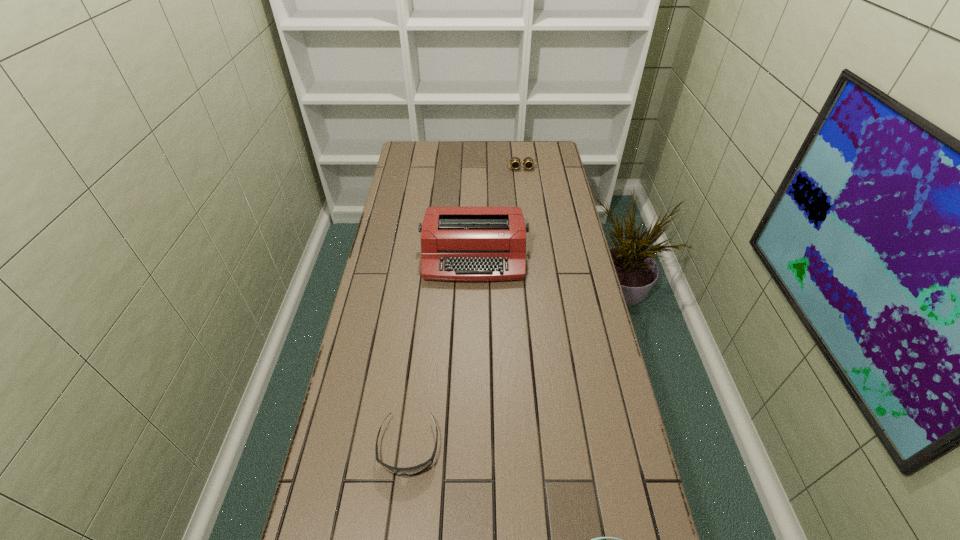
Image resolution: width=960 pixels, height=540 pixels. In order to click on object that stands as the third closest to the typewriter in this screenshot , I will do `click(595, 539)`.

Where is `the closest object to the nearest goggles`? the closest object to the nearest goggles is located at coordinates (408, 471).

Locate an element on the screen. The image size is (960, 540). goggles that can be found as the second closest to the shortest goggles is located at coordinates (515, 162).

The image size is (960, 540). In order to click on goggles that stands as the second closest to the shortest goggles in this screenshot , I will do `click(515, 162)`.